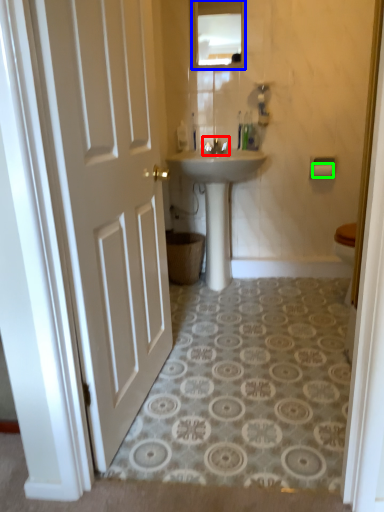
Question: Based on their relative distances, which object is nearer to tap (highlighted by a red box)? Choose from mirror (highlighted by a blue box) and toilet paper (highlighted by a green box).

Choices:
 (A) mirror
 (B) toilet paper

Answer: (A)